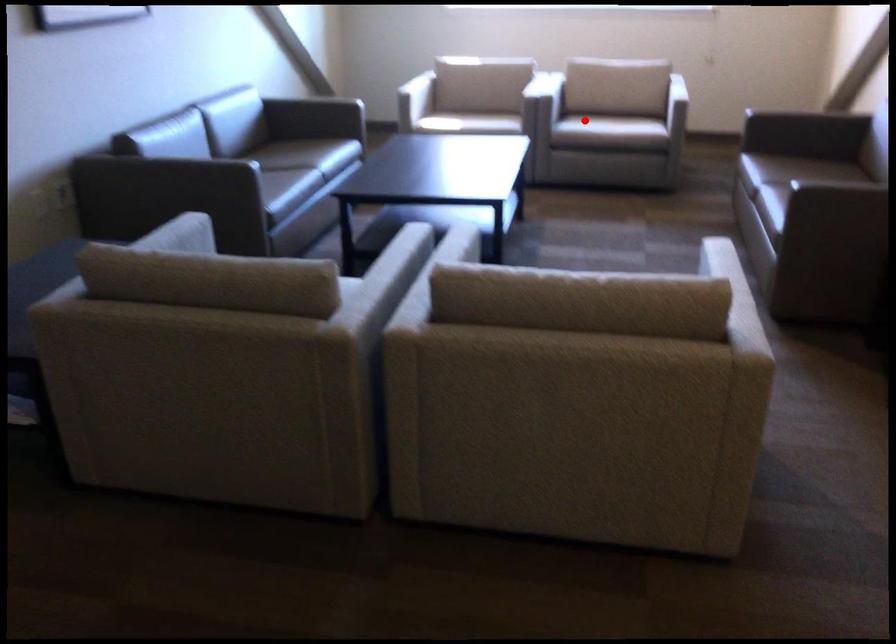
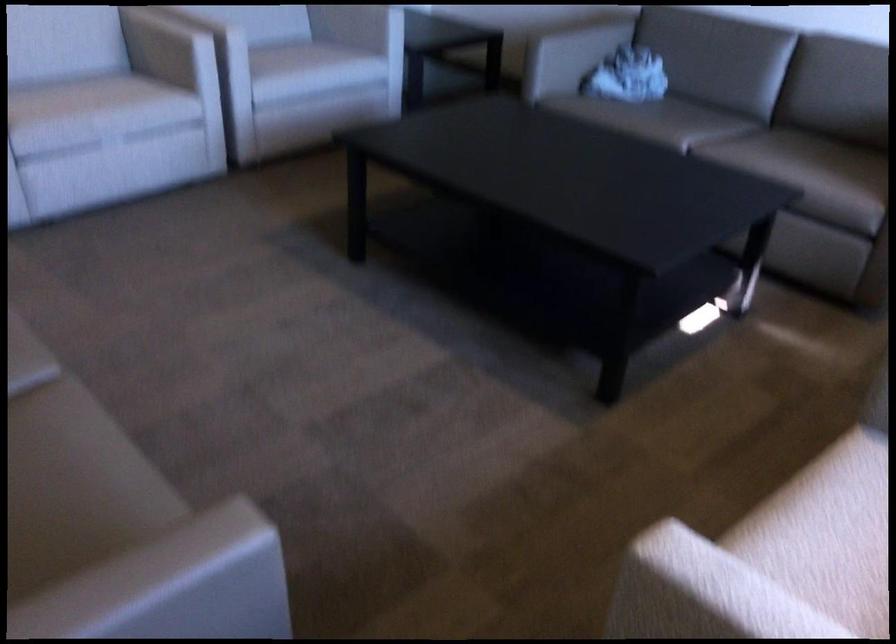
Question: I am providing you with two images of the same scene from different viewpoints. Given a red point in image1, look at the same physical point in image2. Is it:

Choices:
 (A) Closer to the viewpoint
 (B) Farther from the viewpoint

Answer: (A)